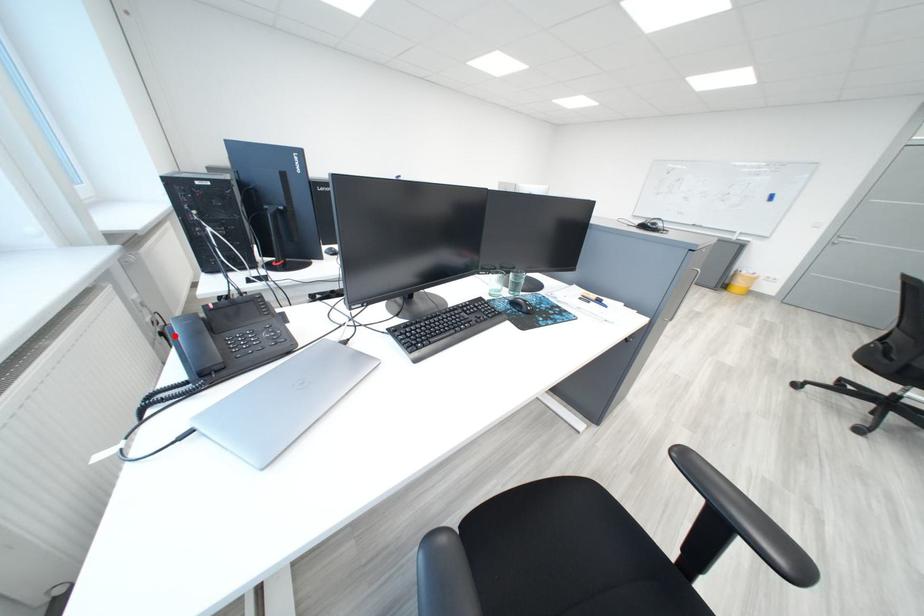
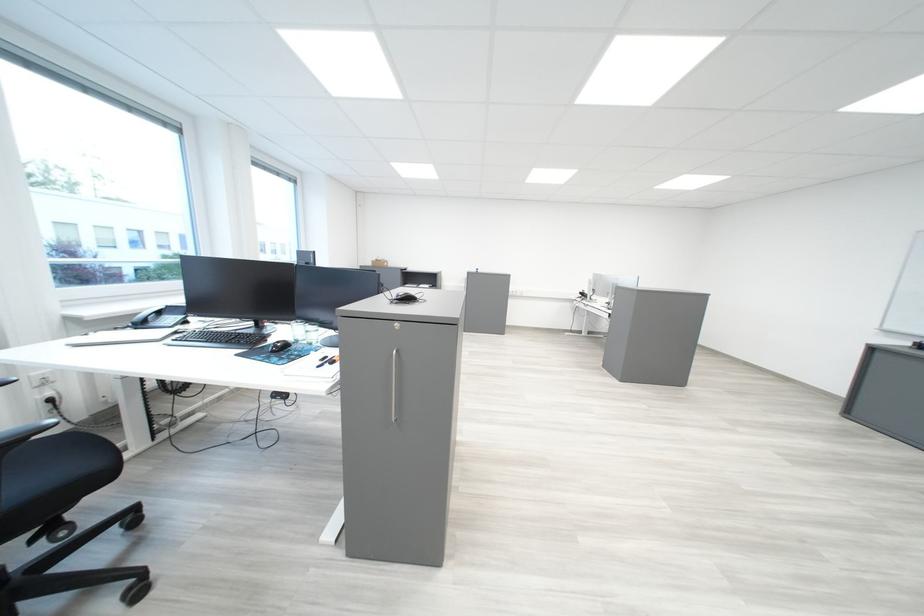
Question: I am providing you with two images of the same scene from different viewpoints. A red point is marked on the first image. Is the red point's position out of view in image 2?

Choices:
 (A) Yes
 (B) No

Answer: (A)